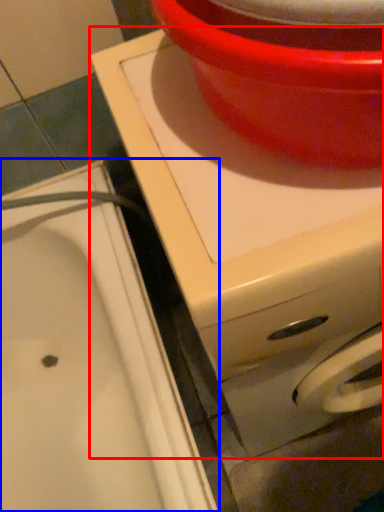
Question: Which of the following is the farthest to the observer, appliance (highlighted by a red box) or sink (highlighted by a blue box)?

Choices:
 (A) appliance
 (B) sink

Answer: (B)